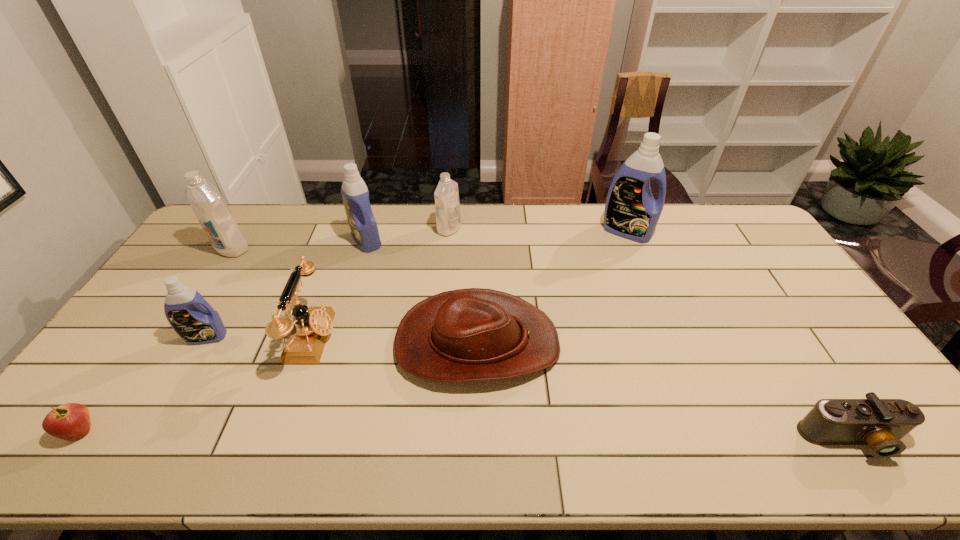
Where is `vacant area that lies between the left white detergent and the second biggest blue detergent`? This screenshot has height=540, width=960. vacant area that lies between the left white detergent and the second biggest blue detergent is located at coordinates (299, 245).

Find the location of a particular element. object that is the third closest to the red apple is located at coordinates (215, 217).

Find the location of a particular element. The image size is (960, 540). object that is the closest one to the nearest blue detergent is located at coordinates click(307, 335).

The width and height of the screenshot is (960, 540). What are the coordinates of `detergent that is the closest to the biggest blue detergent` in the screenshot? It's located at (447, 205).

Identify which detergent is the third nearest to the nearest detergent. Please provide its 2D coordinates. Your answer should be formatted as a tuple, i.e. [(x, y)], where the tuple contains the x and y coordinates of a point satisfying the conditions above.

[(447, 205)]

Where is `blue detergent that is the third closest to the smaller white detergent`? The image size is (960, 540). blue detergent that is the third closest to the smaller white detergent is located at coordinates (189, 314).

Where is `the third closest blue detergent relative to the second detergent from right to left`? The width and height of the screenshot is (960, 540). the third closest blue detergent relative to the second detergent from right to left is located at coordinates (189, 314).

Where is `vacant space that satisfies the following two spatial constraints: 1. on the back side of the nearest blue detergent; 2. on the right side of the fourth detergent from left to right`? The width and height of the screenshot is (960, 540). vacant space that satisfies the following two spatial constraints: 1. on the back side of the nearest blue detergent; 2. on the right side of the fourth detergent from left to right is located at coordinates (269, 229).

Where is `vacant space that satisfies the following two spatial constraints: 1. on the back side of the third detergent from left to right; 2. on the left side of the second detergent from right to left`? The height and width of the screenshot is (540, 960). vacant space that satisfies the following two spatial constraints: 1. on the back side of the third detergent from left to right; 2. on the left side of the second detergent from right to left is located at coordinates (370, 229).